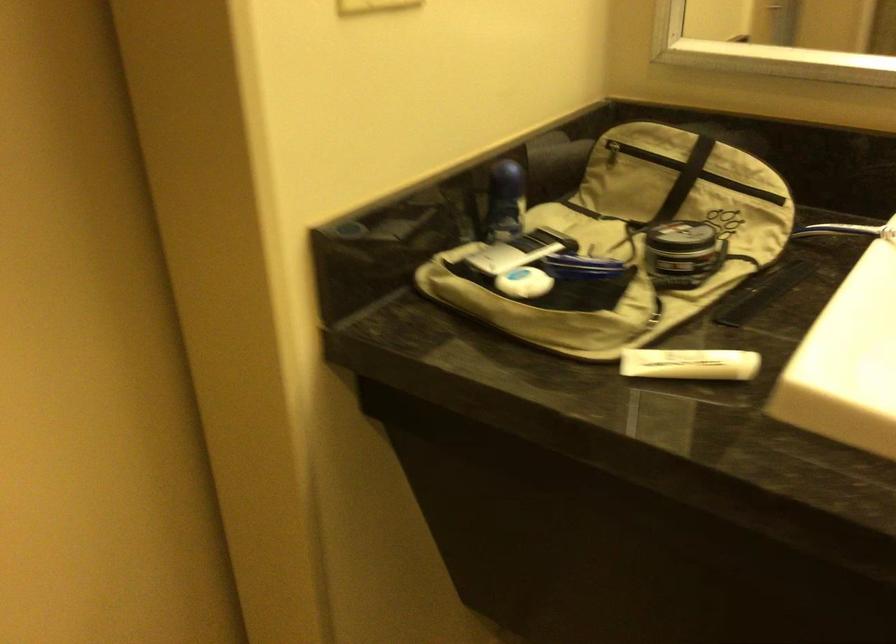
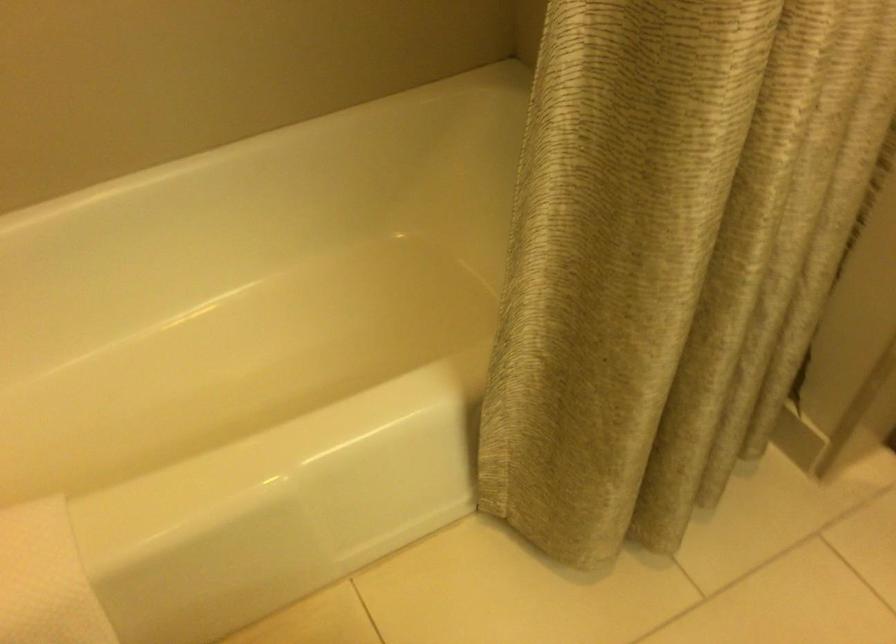
First-person continuous shooting, in which direction is the camera rotating?

The rotation direction of the camera is left-down.